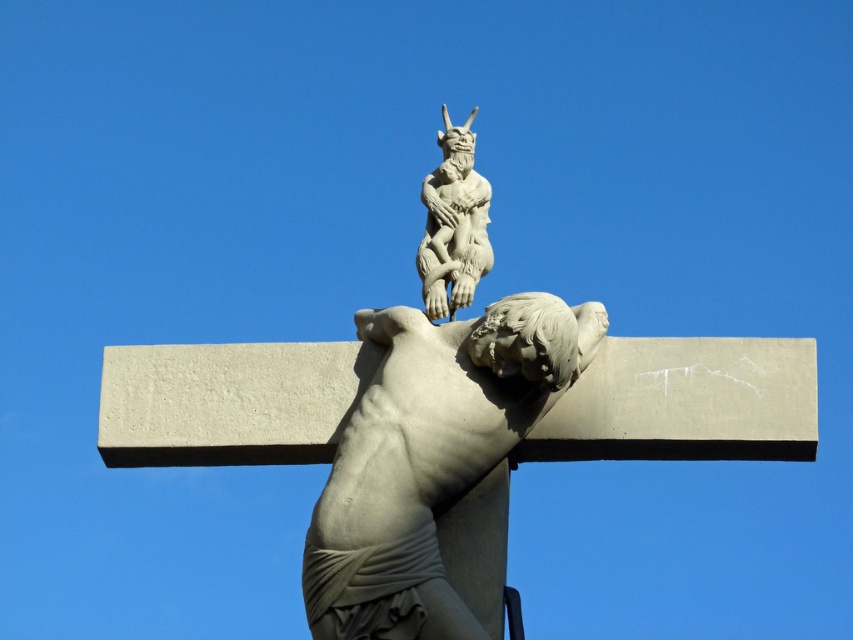
Question: Which of the following is the farthest from the observer?

Choices:
 (A) white stone crucifix at center
 (B) white stone cross at center

Answer: (B)

Question: In this image, where is white stone cross at center located relative to white stone crucifix at center?

Choices:
 (A) above
 (B) below

Answer: (A)

Question: From the image, what is the correct spatial relationship of white stone cross at center in relation to white stone gargoyle at upper center?

Choices:
 (A) right
 (B) left

Answer: (B)

Question: Estimate the real-world distances between objects in this image. Which object is farther from the white stone gargoyle at upper center?

Choices:
 (A) white stone crucifix at center
 (B) white stone cross at center

Answer: (A)

Question: Which object is positioned closest to the white stone cross at center?

Choices:
 (A) white stone gargoyle at upper center
 (B) white stone crucifix at center

Answer: (B)

Question: Is white stone crucifix at center positioned behind white stone gargoyle at upper center?

Choices:
 (A) yes
 (B) no

Answer: (B)